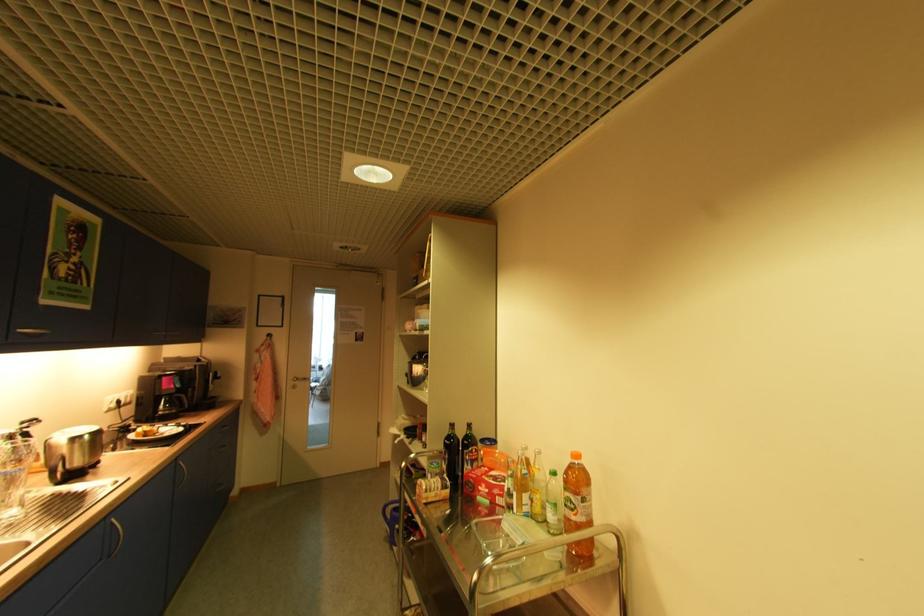
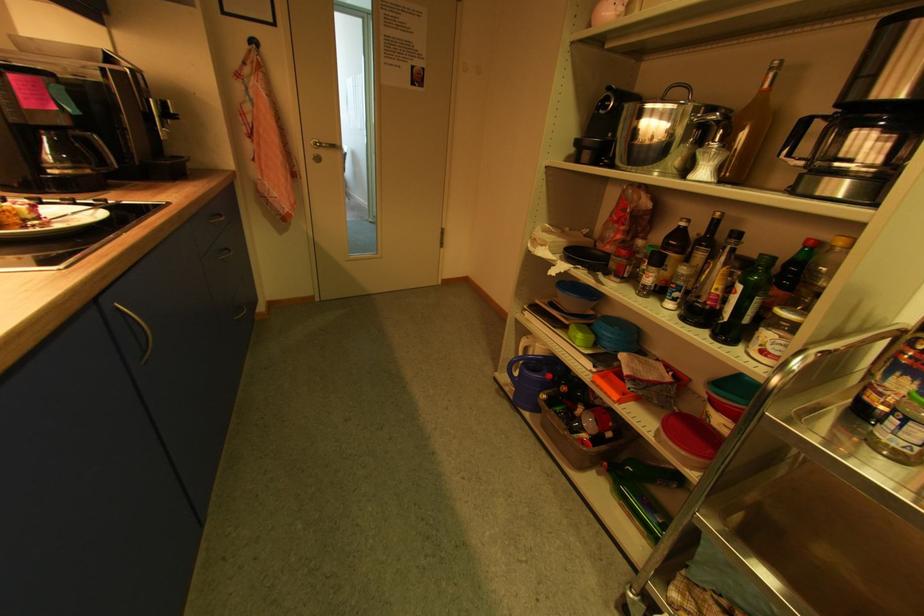
Where in the second image is the point corresponding to point (394, 516) from the first image?

(521, 375)